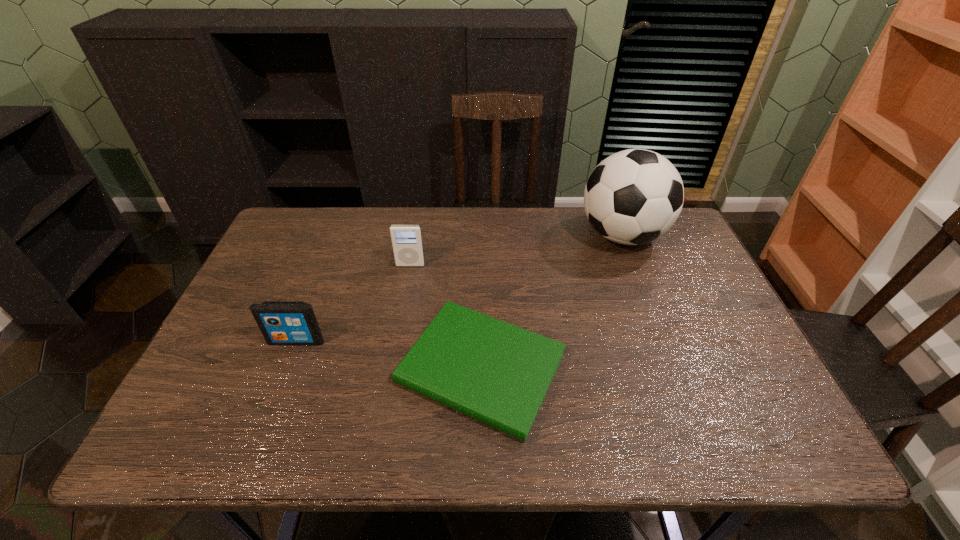
Where is `object that is at the far edge`? object that is at the far edge is located at coordinates (634, 196).

This screenshot has height=540, width=960. What are the coordinates of `object that is at the near edge` in the screenshot? It's located at (497, 373).

Where is `object positioned at the left edge`? object positioned at the left edge is located at coordinates (281, 322).

At what (x,y) coordinates should I click in order to perform the action: click on object situated at the right edge. Please return your answer as a coordinate pair (x, y). Looking at the image, I should click on (634, 196).

This screenshot has height=540, width=960. In order to click on object at the far right corner in this screenshot , I will do `click(634, 196)`.

This screenshot has width=960, height=540. In order to click on vacant space at the far edge of the desktop in this screenshot , I will do click(356, 244).

In the image, there is a desktop. Identify the location of vacant space at the near edge. The width and height of the screenshot is (960, 540). (459, 417).

You are a GUI agent. You are given a task and a screenshot of the screen. Output one action in this format:
    pyautogui.click(x=<x>, y=<y>)
    Task: Click on the vacant space at the left edge of the desktop
    
    Given the screenshot: What is the action you would take?
    pyautogui.click(x=310, y=274)

The width and height of the screenshot is (960, 540). In the image, there is a desktop. What are the coordinates of `vacant area at the right edge` in the screenshot? It's located at (714, 313).

You are a GUI agent. You are given a task and a screenshot of the screen. Output one action in this format:
    pyautogui.click(x=<x>, y=<y>)
    Task: Click on the free space at the far left corner
    
    Given the screenshot: What is the action you would take?
    pyautogui.click(x=306, y=223)